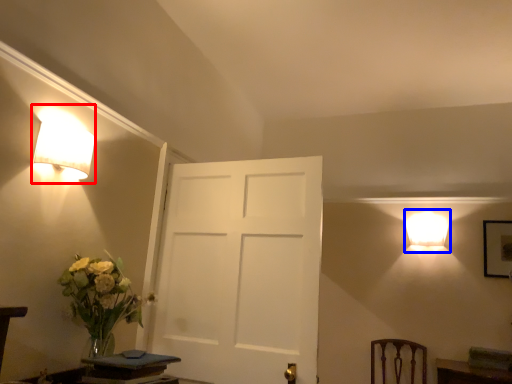
Question: Which object is closer to the camera taking this photo, lamp (highlighted by a red box) or lamp (highlighted by a blue box)?

Choices:
 (A) lamp
 (B) lamp

Answer: (A)